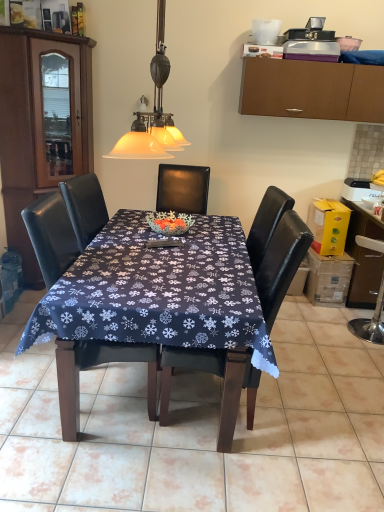
Question: Can you confirm if dark blue fabric tablecloth at center is thinner than black leather chair at center, which is the 1th chair from right to left?

Choices:
 (A) yes
 (B) no

Answer: (B)

Question: Is black leather chair at center, which is the 1th chair from right to left, inside dark blue fabric tablecloth at center?

Choices:
 (A) no
 (B) yes

Answer: (B)

Question: Is dark blue fabric tablecloth at center looking in the opposite direction of black leather chair at center, acting as the second chair starting from the left?

Choices:
 (A) yes
 (B) no

Answer: (B)

Question: From the image's perspective, would you say dark blue fabric tablecloth at center is shown under black leather chair at center, which is the 1th chair from right to left?

Choices:
 (A) yes
 (B) no

Answer: (A)

Question: Considering the relative positions of dark blue fabric tablecloth at center and black leather chair at center, which is the 1th chair from right to left, in the image provided, is dark blue fabric tablecloth at center to the right of black leather chair at center, which is the 1th chair from right to left, from the viewer's perspective?

Choices:
 (A) yes
 (B) no

Answer: (B)

Question: Is dark blue fabric tablecloth at center positioned beyond the bounds of black leather chair at center, which is the 1th chair from right to left?

Choices:
 (A) no
 (B) yes

Answer: (B)

Question: Is brown wood cabinet at left, which ranks as the first cabinetry in left-to-right order, oriented away from translucent glass pendant light at upper center?

Choices:
 (A) yes
 (B) no

Answer: (B)

Question: Could translucent glass pendant light at upper center be considered to be inside brown wood cabinet at left, which ranks as the first cabinetry in left-to-right order?

Choices:
 (A) yes
 (B) no

Answer: (B)

Question: From the image's perspective, does brown wood cabinet at left, which ranks as the first cabinetry in left-to-right order, appear lower than translucent glass pendant light at upper center?

Choices:
 (A) yes
 (B) no

Answer: (A)

Question: Considering the relative sizes of brown wood cabinet at left, which ranks as the first cabinetry in left-to-right order, and translucent glass pendant light at upper center in the image provided, is brown wood cabinet at left, which ranks as the first cabinetry in left-to-right order, bigger than translucent glass pendant light at upper center?

Choices:
 (A) yes
 (B) no

Answer: (A)

Question: Are brown wood cabinet at left, which ranks as the first cabinetry in left-to-right order, and translucent glass pendant light at upper center located far from each other?

Choices:
 (A) no
 (B) yes

Answer: (B)

Question: Does brown wood cabinet at left, which ranks as the first cabinetry in left-to-right order, have a smaller size compared to translucent glass pendant light at upper center?

Choices:
 (A) no
 (B) yes

Answer: (A)

Question: Is the position of dark blue fabric at center less distant than that of black leather chair at center, the 2th chair in the right-to-left sequence?

Choices:
 (A) yes
 (B) no

Answer: (A)